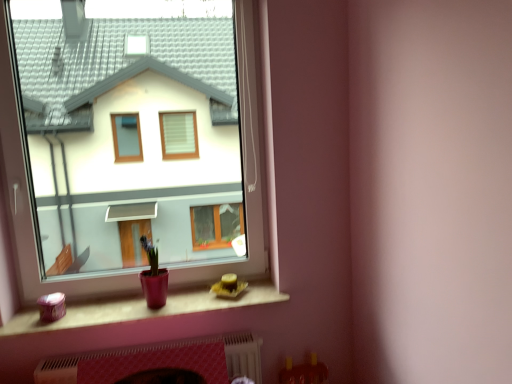
Question: Based on their positions, is white textured fireplace at lower center located to the left or right of matte plastic window sill at lower center?

Choices:
 (A) left
 (B) right

Answer: (B)

Question: Relative to matte plastic window sill at lower center, is white textured fireplace at lower center in front or behind?

Choices:
 (A) front
 (B) behind

Answer: (B)

Question: Estimate the real-world distances between objects in this image. Which object is closer to the white textured fireplace at lower center?

Choices:
 (A) matte plastic window sill at lower center
 (B) matte glass window at center

Answer: (A)

Question: Which of these objects is positioned farthest from the matte plastic window sill at lower center?

Choices:
 (A) matte glass window at center
 (B) white textured fireplace at lower center

Answer: (A)